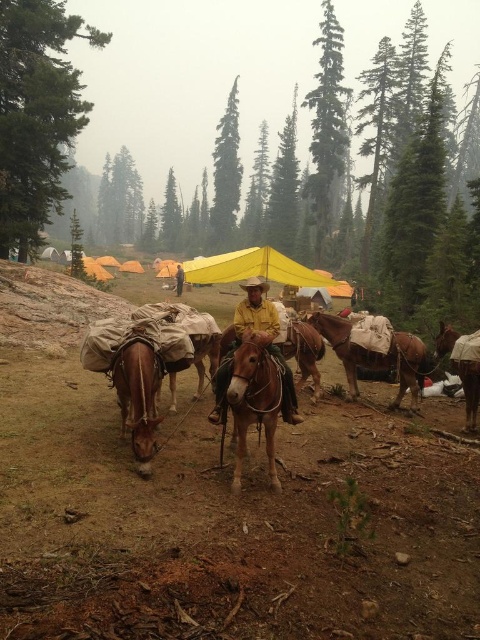
Looking at this image, you are a hiker planning to set up a tent in this forest clearing. You see a brown leather horse at center and a yellow fabric canopy at center. Which object takes up more space in the clearing?

The yellow fabric canopy at center takes up more space than the brown leather horse at center because the brown leather horse at center occupies less space than yellow fabric canopy at center.

You are a hiker trying to reach the tents in the background. You see two horses, the brown leather horse at center and the brown leather horse at lower left. Which horse is closer to you?

The brown leather horse at center is closer to the viewer than the brown leather horse at lower left.